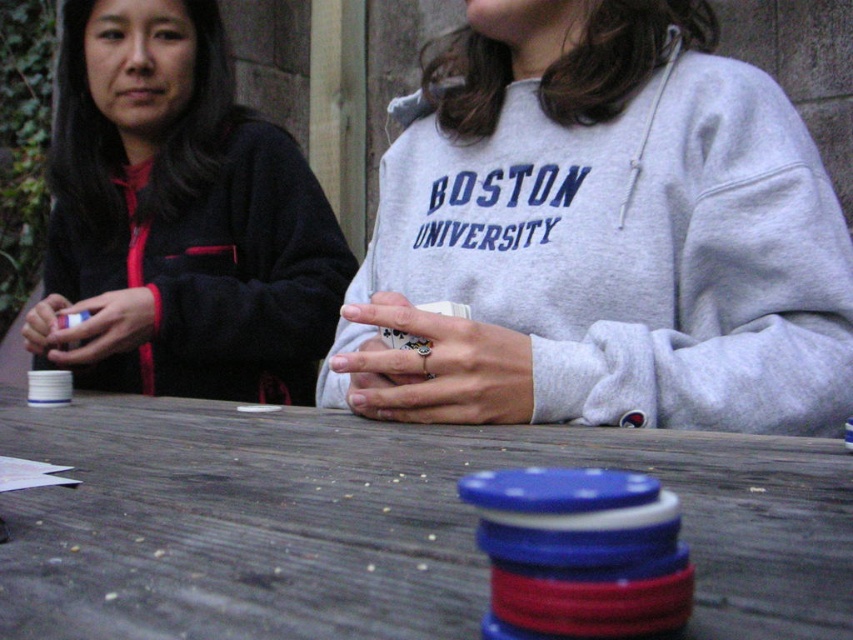
Between point (194, 476) and point (273, 148), which one is positioned behind?

The point (273, 148) is behind.

Who is higher up, wooden table at center or dark blue fleece jacket at left?

Positioned higher is dark blue fleece jacket at left.

At what (x,y) coordinates should I click in order to perform the action: click on wooden table at center. Please return your answer as a coordinate pair (x, y). Looking at the image, I should click on (375, 524).

Which of these two, gray cotton sweatshirt at center or dark blue fleece jacket at left, stands taller?

dark blue fleece jacket at left is taller.

Is gray cotton sweatshirt at center wider than dark blue fleece jacket at left?

In fact, gray cotton sweatshirt at center might be narrower than dark blue fleece jacket at left.

Identify the location of gray cotton sweatshirt at center. (602, 236).

The height and width of the screenshot is (640, 853). Find the location of `gray cotton sweatshirt at center`. gray cotton sweatshirt at center is located at coordinates tap(602, 236).

Does gray cotton sweatshirt at center have a larger size compared to wooden table at center?

Indeed, gray cotton sweatshirt at center has a larger size compared to wooden table at center.

Is gray cotton sweatshirt at center to the left of wooden table at center from the viewer's perspective?

In fact, gray cotton sweatshirt at center is to the right of wooden table at center.

Is point (762, 314) positioned before point (795, 536)?

No, it is not.

This screenshot has width=853, height=640. In order to click on gray cotton sweatshirt at center in this screenshot , I will do `click(602, 236)`.